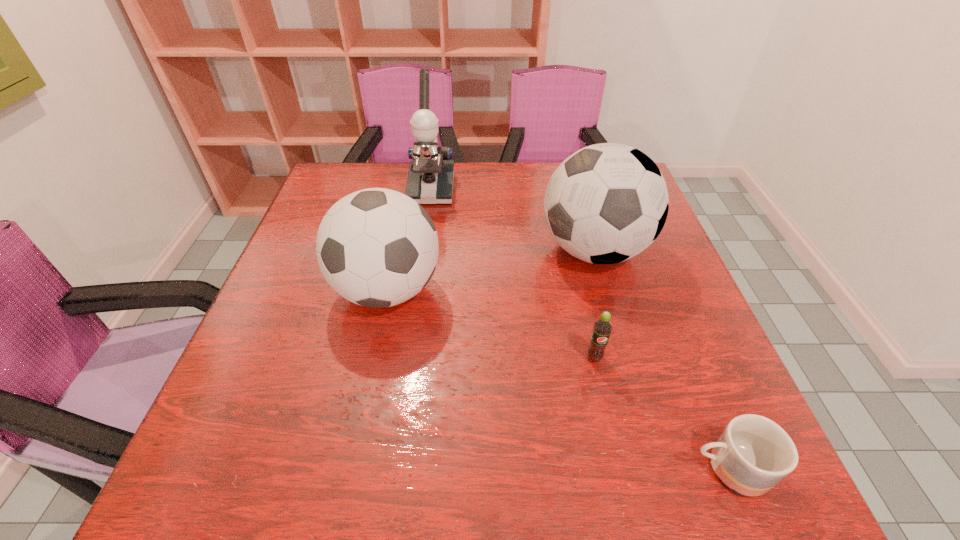
Where is `vacant position located on the main logo of the right soccer ball`? The image size is (960, 540). vacant position located on the main logo of the right soccer ball is located at coordinates (470, 250).

Find the location of a particular element. This screenshot has width=960, height=540. free region located 0.100m on the main logo of the right soccer ball is located at coordinates (499, 250).

Locate an element on the screen. free space located 0.240m on the front of the left soccer ball is located at coordinates (354, 447).

Identify the location of free region located 0.060m on the front label of the fourth tallest object. The image size is (960, 540). (602, 392).

Image resolution: width=960 pixels, height=540 pixels. Identify the location of free spot located 0.100m on the side with the handle of the shortest object. (625, 469).

Identify the location of vacant space located 0.200m on the side with the handle of the shortest object. The image size is (960, 540). (563, 469).

Locate an element on the screen. This screenshot has width=960, height=540. blank area located on the side with the handle of the shortest object is located at coordinates (524, 469).

Identify the location of object located at the far edge. (430, 180).

Identify the location of object that is at the near edge. This screenshot has width=960, height=540. (753, 453).

The height and width of the screenshot is (540, 960). What are the coordinates of `object that is positioned at the left edge` in the screenshot? It's located at (x=376, y=247).